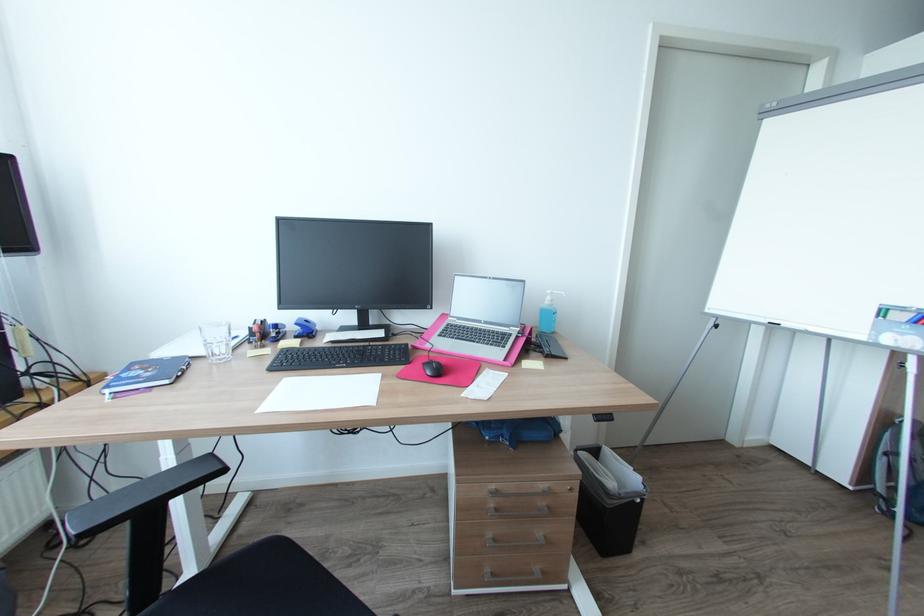
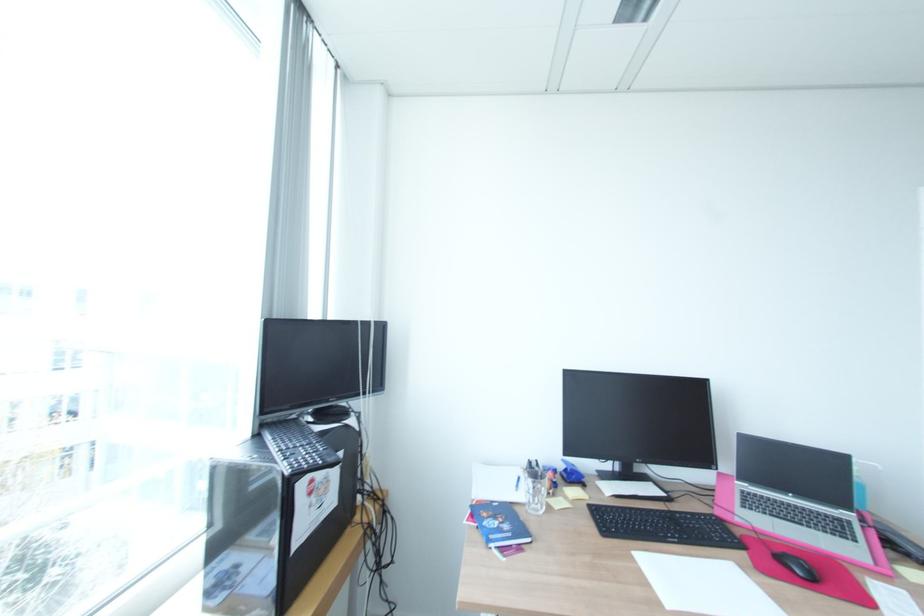
Where in the second image is the point corresponding to point (225, 354) from the first image?

(541, 505)